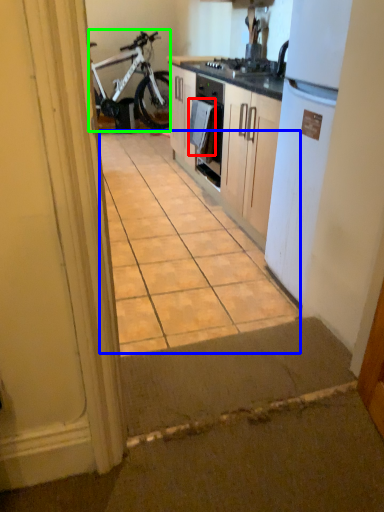
Question: Which object is positioned closest to towel/napkin (highlighted by a red box)? Select from ceramic tile (highlighted by a blue box) and bicycle (highlighted by a green box).

Choices:
 (A) ceramic tile
 (B) bicycle

Answer: (A)